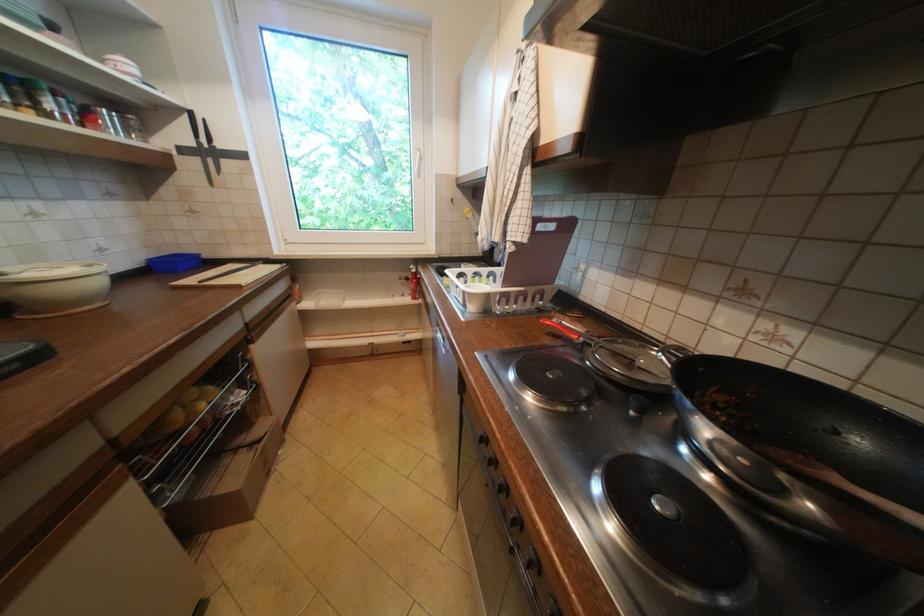
What do you see at coordinates (242, 268) in the screenshot? This screenshot has height=616, width=924. I see `the cutting board handle` at bounding box center [242, 268].